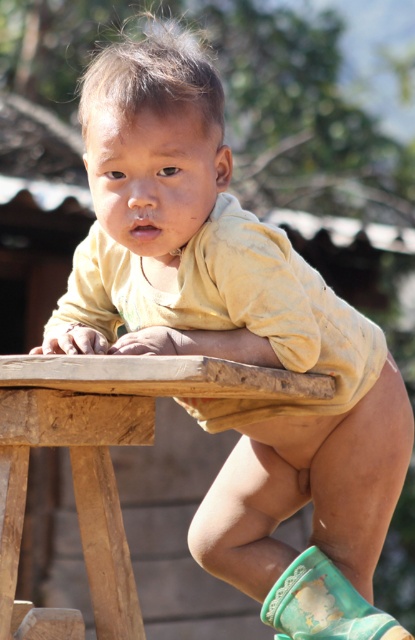
Is point (100, 609) behind point (310, 556)?

Yes, it is behind point (310, 556).

Who is more distant from viewer, (34, 394) or (376, 618)?

The point (376, 618) is more distant.

Where is `wooden table at center`? This screenshot has width=415, height=640. wooden table at center is located at coordinates (104, 451).